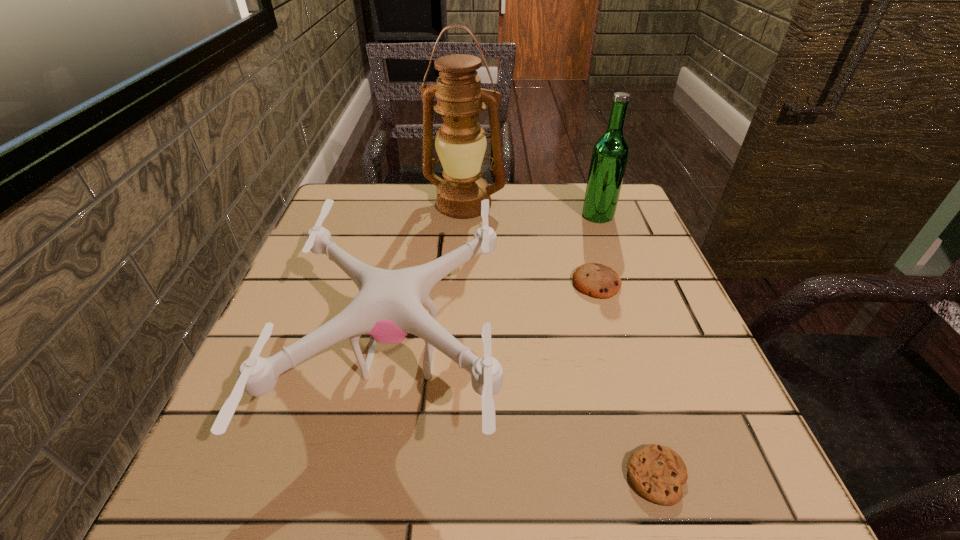
Locate an element on the screen. This screenshot has width=960, height=540. vacant space that satisfies the following two spatial constraints: 1. on the back side of the beer bottle; 2. on the left side of the shortest object is located at coordinates (578, 215).

The height and width of the screenshot is (540, 960). I want to click on vacant space that satisfies the following two spatial constraints: 1. on the top of the third shortest object; 2. on the right side of the shorter cookie, so click(x=380, y=476).